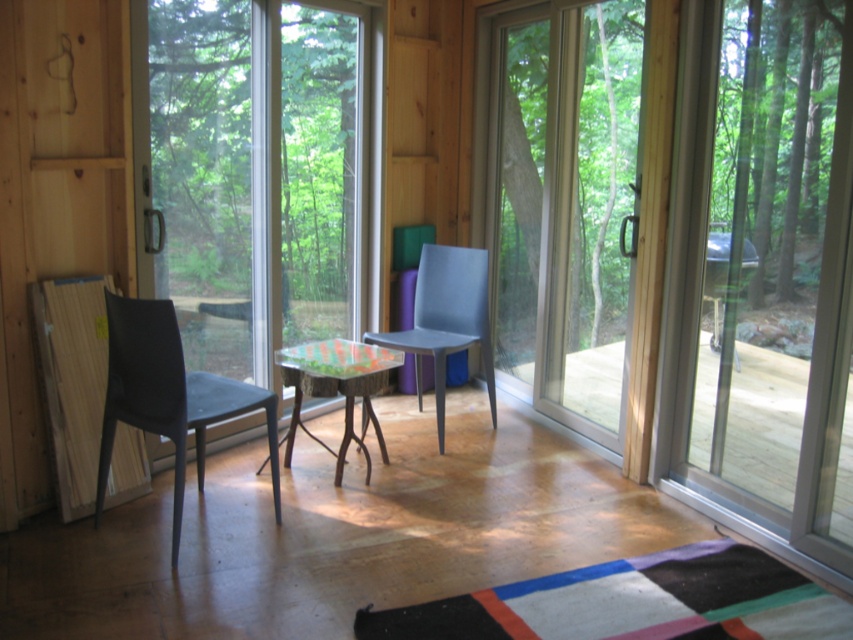
Does wooden deck at lower right have a lesser height compared to transparent glass window at left?

Correct, wooden deck at lower right is not as tall as transparent glass window at left.

Is wooden deck at lower right to the right of transparent glass window at left from the viewer's perspective?

Indeed, wooden deck at lower right is positioned on the right side of transparent glass window at left.

Does point (245, 538) come in front of point (318, 35)?

Yes, it is in front of point (318, 35).

Find the location of a particular element. This screenshot has height=640, width=853. wooden deck at lower right is located at coordinates (335, 534).

What do you see at coordinates (335, 534) in the screenshot? I see `wooden deck at lower right` at bounding box center [335, 534].

Is wooden deck at lower right closer to the viewer compared to matte blue chair at center?

Yes, wooden deck at lower right is closer to the viewer.

Image resolution: width=853 pixels, height=640 pixels. What do you see at coordinates (335, 534) in the screenshot?
I see `wooden deck at lower right` at bounding box center [335, 534].

Where is `wooden deck at lower right`? Image resolution: width=853 pixels, height=640 pixels. wooden deck at lower right is located at coordinates (335, 534).

Can you confirm if transparent glass screen door at right is positioned above matte black chair at left?

Yes.

I want to click on transparent glass screen door at right, so click(762, 275).

This screenshot has height=640, width=853. What do you see at coordinates (762, 275) in the screenshot?
I see `transparent glass screen door at right` at bounding box center [762, 275].

You are a GUI agent. You are given a task and a screenshot of the screen. Output one action in this format:
    pyautogui.click(x=<x>, y=<y>)
    Task: Click on the transparent glass screen door at right
    
    Given the screenshot: What is the action you would take?
    pyautogui.click(x=762, y=275)